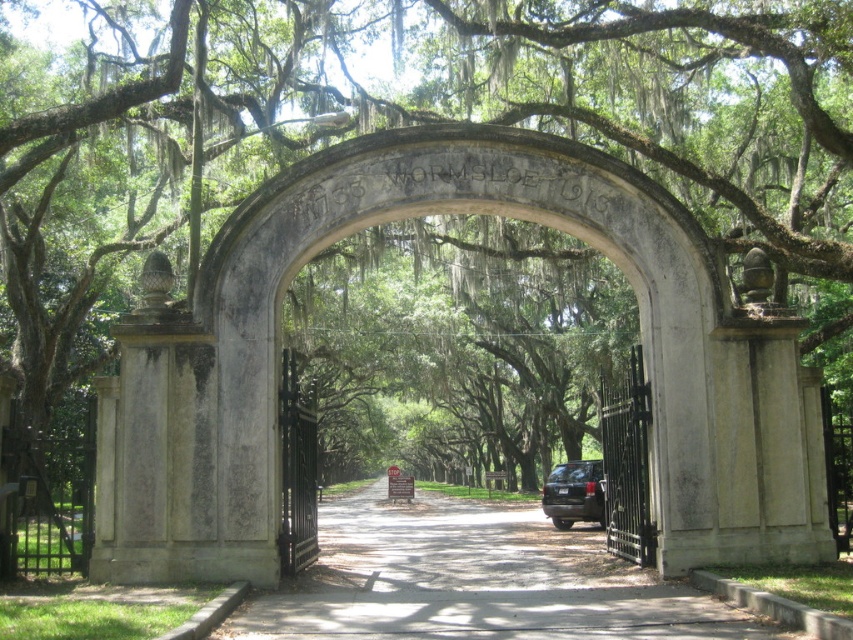
You are driving a shiny black suv at center and want to park it on the smooth asphalt driveway at center. Can you do so without moving the suv?

The smooth asphalt driveway at center is to the left of the shiny black suv at center, so the suv is already positioned on the driveway and can be parked there without moving it.

You are driving a shiny black suv at center and want to park it on the smooth asphalt driveway at center. Is there enough space for the suv to fit on the driveway?

The smooth asphalt driveway at center is in front of the shiny black suv at center, which means the suv is already positioned on the driveway. Therefore, there is sufficient space for the suv to park there.